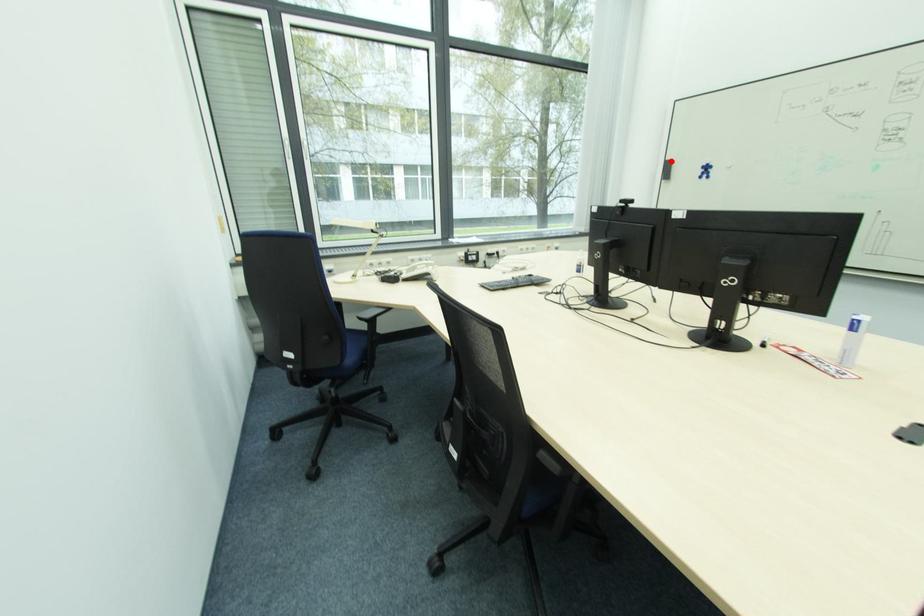
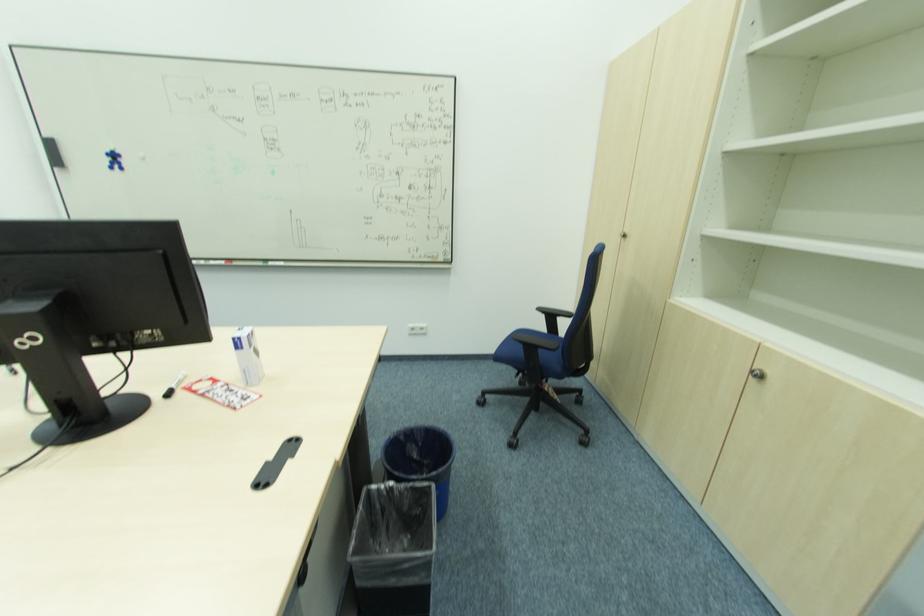
Where in the second image is the point corresponding to the highlighted location from the first image?

(52, 140)